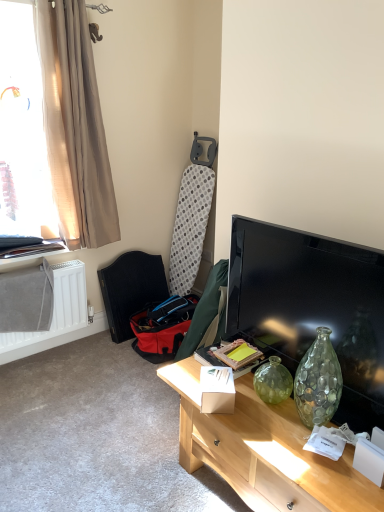
The width and height of the screenshot is (384, 512). Find the location of `vacant area that is situated to the right of white cardboard box at center`. vacant area that is situated to the right of white cardboard box at center is located at coordinates (267, 412).